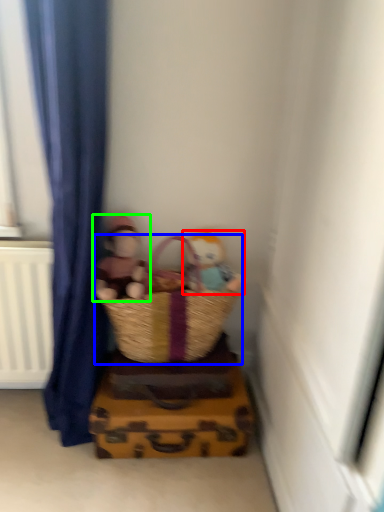
Question: Which object is positioned farthest from person (highlighted by a red box)? Select from picnic basket (highlighted by a blue box) and person (highlighted by a green box).

Choices:
 (A) picnic basket
 (B) person

Answer: (B)